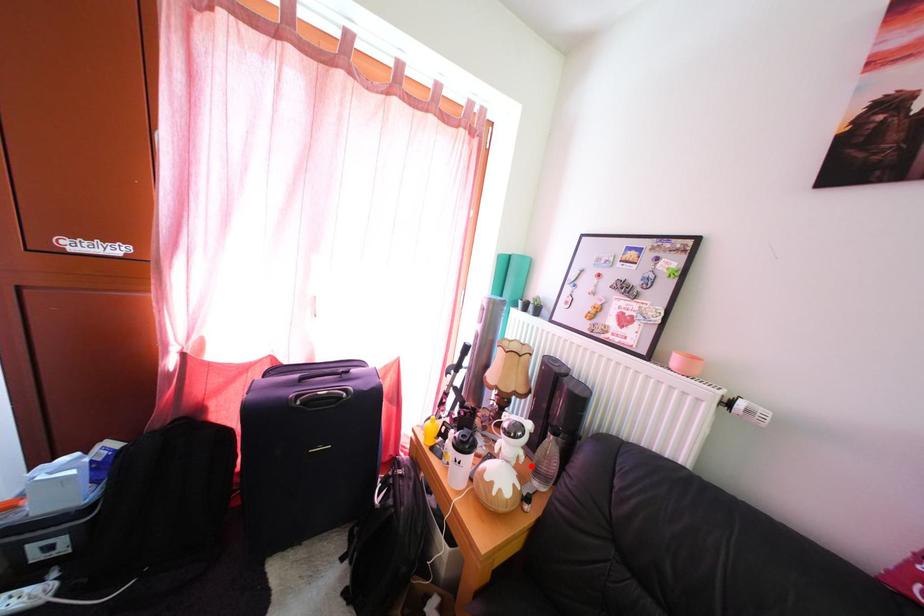
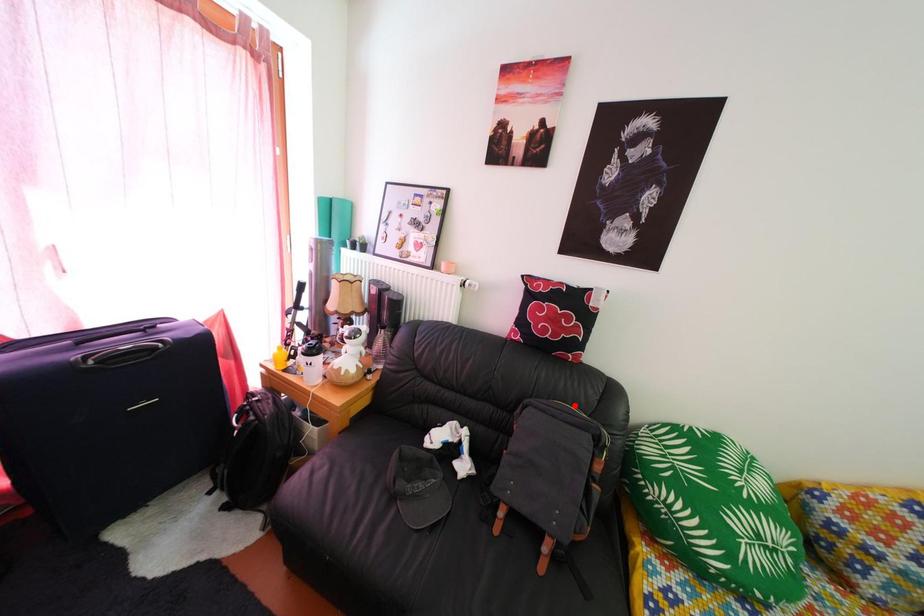
Based on the photo, I am providing you with two images of the same scene from different viewpoints. A red point is marked on the first image and another point is marked on the second image. Are the points marked in image1 and image2 representing the same 3D position?

No